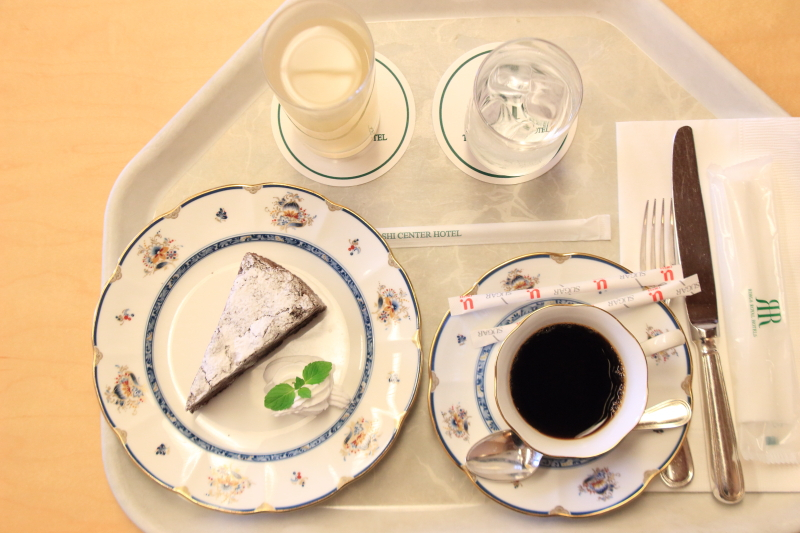
Identify the location of spoon. (521, 453).